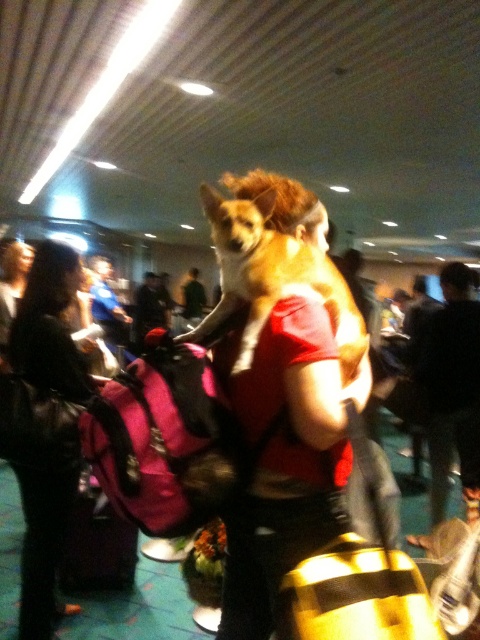
You are organizing a photo shoot and need to place a tripod between the black leather jacket at left and the brown furry dog at center. Given their sizes, which object should the tripod be closer to?

The black leather jacket at left is larger in size than the brown furry dog at center, so the tripod should be placed closer to the brown furry dog at center to maintain balance in the composition.

You are at an event and need to find a place to hang your black leather jacket at left. The brown furry dog at center is in the way. Can you hang the jacket on a hook behind the dog?

The black leather jacket at left is taller than the brown furry dog at center, so you can hang it behind the dog as the jacket is taller and won